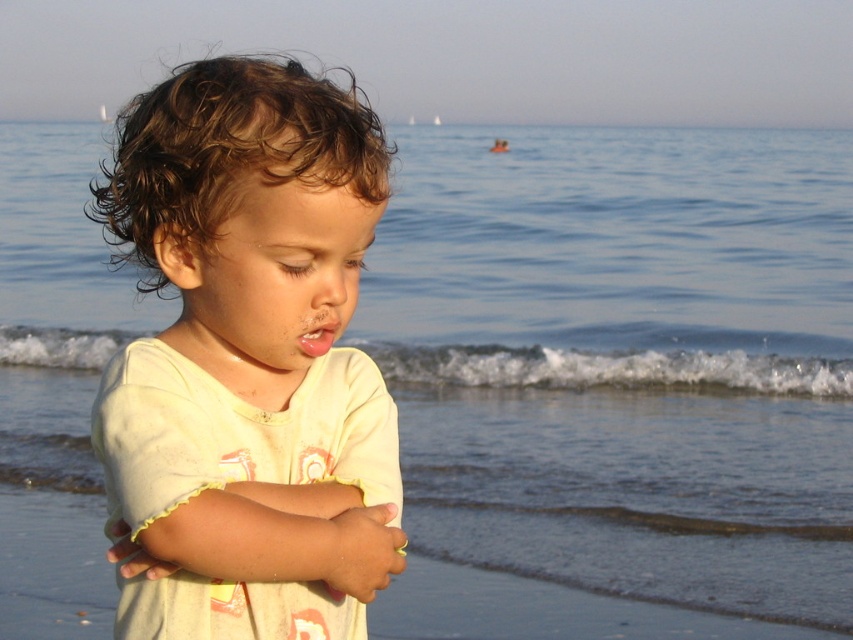
Question: Is light yellow cotton shirt at center bigger than pink matte lips at center?

Choices:
 (A) yes
 (B) no

Answer: (A)

Question: Is light yellow cotton shirt at center thinner than pink matte lips at center?

Choices:
 (A) yes
 (B) no

Answer: (B)

Question: Is light yellow cotton shirt at center smaller than pink matte lips at center?

Choices:
 (A) yes
 (B) no

Answer: (B)

Question: Which object appears farthest from the camera in this image?

Choices:
 (A) light yellow cotton shirt at center
 (B) pink matte lips at center

Answer: (B)

Question: Which of the following is the farthest from the observer?

Choices:
 (A) (233, 307)
 (B) (315, 342)

Answer: (A)